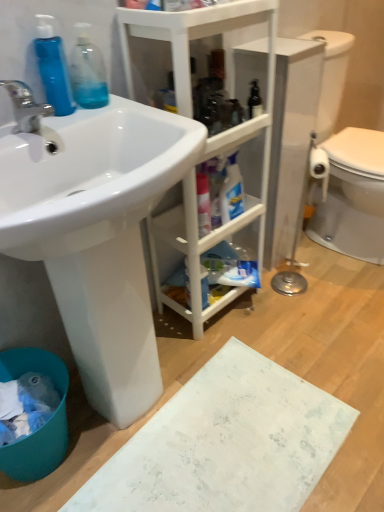
Question: Considering the relative sizes of white matte cabinet at center and matte silver faucet at left in the image provided, is white matte cabinet at center bigger than matte silver faucet at left?

Choices:
 (A) no
 (B) yes

Answer: (B)

Question: Is white matte cabinet at center positioned with its back to matte silver faucet at left?

Choices:
 (A) no
 (B) yes

Answer: (A)

Question: Is white matte cabinet at center in contact with matte silver faucet at left?

Choices:
 (A) no
 (B) yes

Answer: (A)

Question: Considering the relative positions of white matte cabinet at center and matte silver faucet at left in the image provided, is white matte cabinet at center to the left of matte silver faucet at left from the viewer's perspective?

Choices:
 (A) yes
 (B) no

Answer: (B)

Question: Does white matte cabinet at center have a lesser width compared to matte silver faucet at left?

Choices:
 (A) yes
 (B) no

Answer: (B)

Question: In terms of height, does blue plastic bottle at left, the first cleaning product when ordered from left to right, look taller or shorter compared to blue plastic bucket at lower left?

Choices:
 (A) tall
 (B) short

Answer: (B)

Question: From the image's perspective, is blue plastic bottle at left, the first cleaning product when ordered from left to right, located above or below blue plastic bucket at lower left?

Choices:
 (A) above
 (B) below

Answer: (A)

Question: Is point (61, 65) closer or farther from the camera than point (6, 448)?

Choices:
 (A) farther
 (B) closer

Answer: (B)

Question: Is blue plastic bottle at left, which appears as the second cleaning product when viewed from the right, inside or outside of blue plastic bucket at lower left?

Choices:
 (A) outside
 (B) inside

Answer: (A)

Question: From a real-world perspective, relative to blue plastic bucket at lower left, is transparent plastic bottle at upper left, the 1th cleaning product positioned from the right, vertically above or below?

Choices:
 (A) above
 (B) below

Answer: (A)

Question: Is transparent plastic bottle at upper left, the 2th cleaning product when ordered from left to right, situated inside blue plastic bucket at lower left or outside?

Choices:
 (A) inside
 (B) outside

Answer: (B)

Question: Is transparent plastic bottle at upper left, the 1th cleaning product positioned from the right, wider or thinner than blue plastic bucket at lower left?

Choices:
 (A) thin
 (B) wide

Answer: (A)

Question: Based on their positions, is transparent plastic bottle at upper left, the 1th cleaning product positioned from the right, located to the left or right of blue plastic bucket at lower left?

Choices:
 (A) right
 (B) left

Answer: (A)

Question: Looking at the image, does matte silver faucet at left seem bigger or smaller compared to blue plastic bottle at left, the first cleaning product when ordered from left to right?

Choices:
 (A) small
 (B) big

Answer: (B)

Question: Visually, is matte silver faucet at left positioned to the left or to the right of blue plastic bottle at left, which appears as the second cleaning product when viewed from the right?

Choices:
 (A) right
 (B) left

Answer: (B)